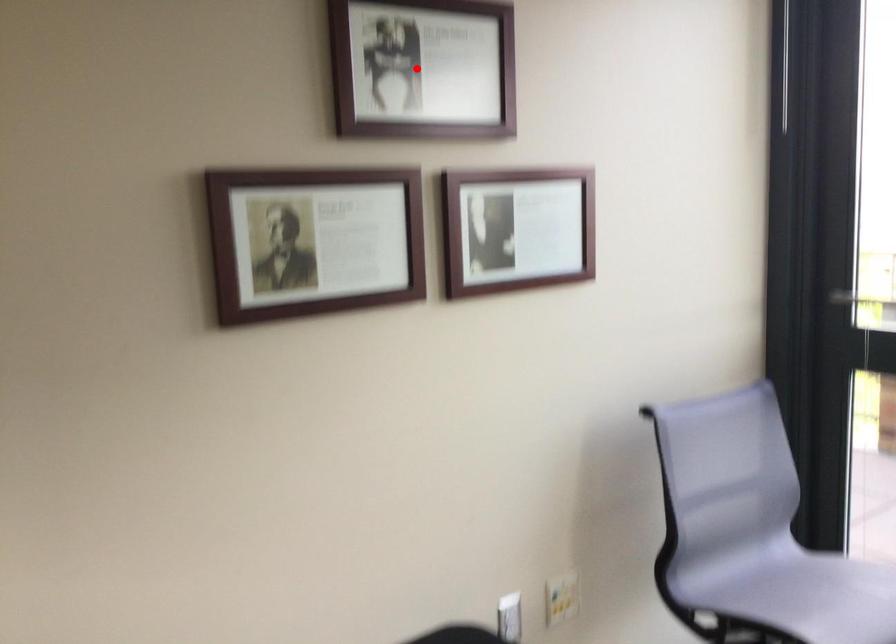
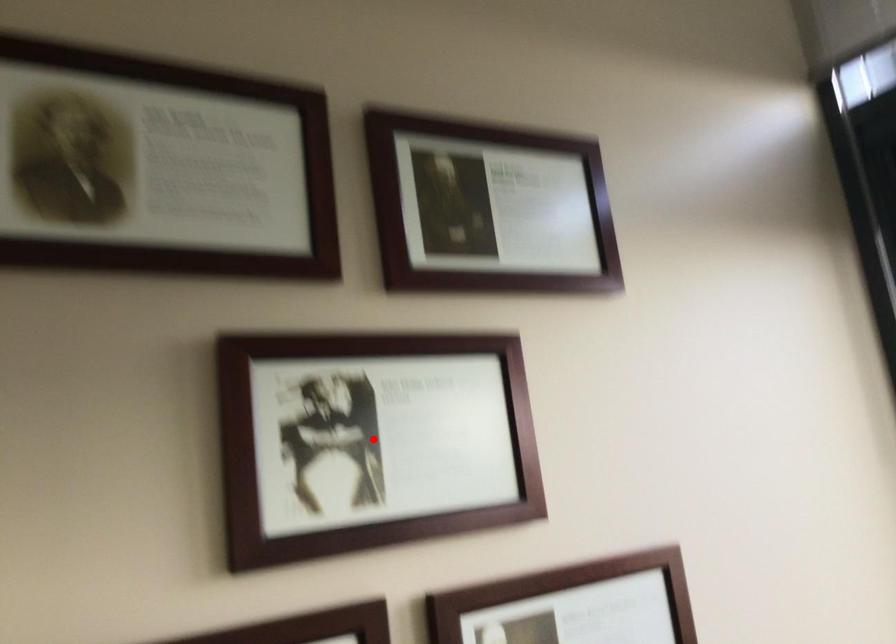
I am providing you with two images of the same scene from different viewpoints. A red point is marked on the first image and another point is marked on the second image. Do the highlighted points in image1 and image2 indicate the same real-world spot?

Yes